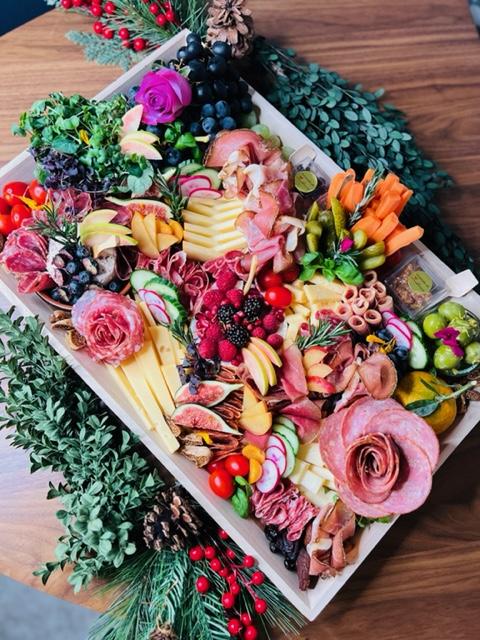
Identify the location of white dish. The image size is (480, 640). (202, 502).